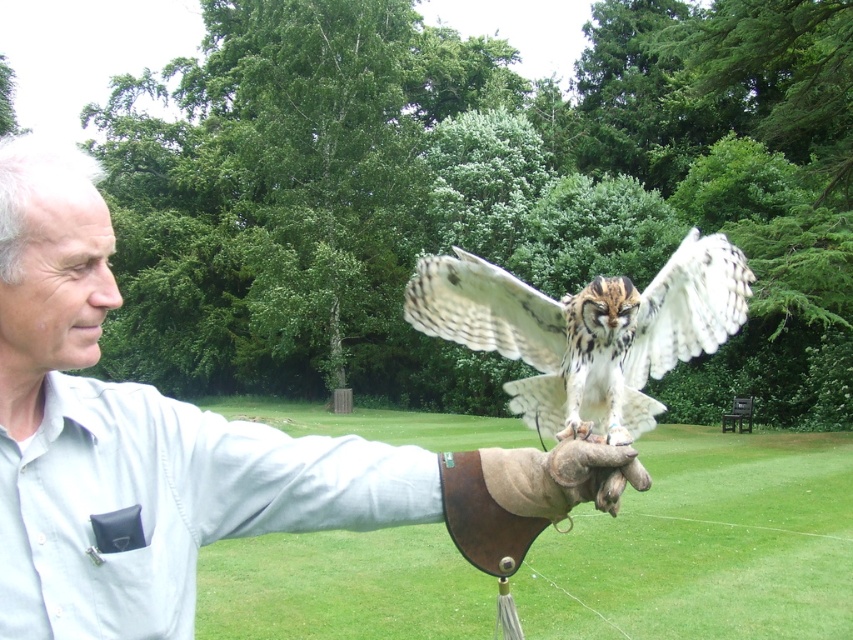
Question: Does brown leather glove at center have a smaller size compared to leather glove at center?

Choices:
 (A) no
 (B) yes

Answer: (A)

Question: Is light blue shirt at center to the right of white feathered owl at center from the viewer's perspective?

Choices:
 (A) yes
 (B) no

Answer: (B)

Question: Is light blue shirt at center smaller than brown leather glove at center?

Choices:
 (A) yes
 (B) no

Answer: (A)

Question: Which of the following is the farthest from the observer?

Choices:
 (A) (535, 368)
 (B) (556, 467)

Answer: (A)

Question: Which point is farther to the camera?

Choices:
 (A) white feathered owl at center
 (B) brown leather glove at center

Answer: (A)

Question: Which of the following is the closest to the observer?

Choices:
 (A) (628, 476)
 (B) (103, 467)
 (C) (577, 490)
 (D) (606, 406)

Answer: (B)